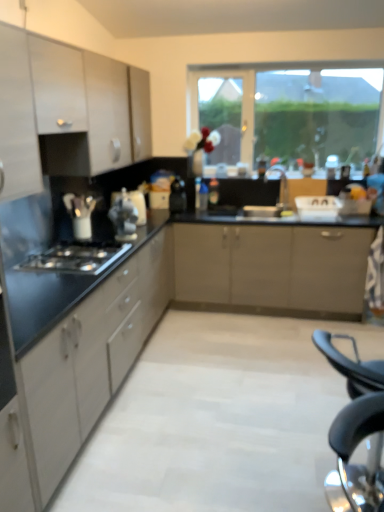
The width and height of the screenshot is (384, 512). Identify the location of vacant region under matte white cabinet at left, marked as the second cabinetry in a bottom-to-top arrangement (from a real-world perspective). (23, 284).